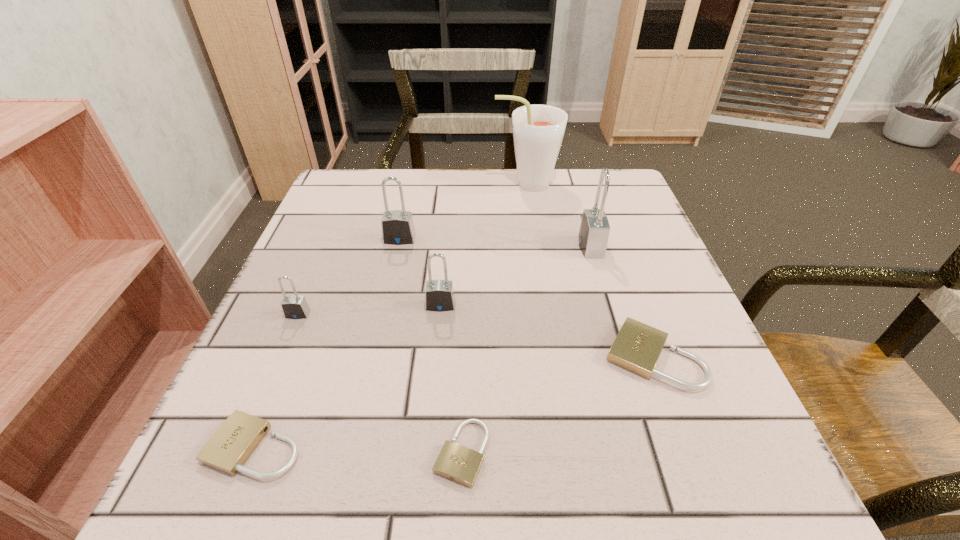
In order to click on free space between the third gray padlock from left to right and the root beer in this screenshot , I will do `click(483, 245)`.

Image resolution: width=960 pixels, height=540 pixels. I want to click on empty space that is in between the smallest beige padlock and the biggest beige padlock, so click(x=558, y=404).

The width and height of the screenshot is (960, 540). I want to click on vacant space that is in between the fifth tallest object and the second biggest gray padlock, so click(348, 276).

Where is `empty space that is in between the third nearest padlock and the leftmost gray padlock`? This screenshot has height=540, width=960. empty space that is in between the third nearest padlock and the leftmost gray padlock is located at coordinates (475, 335).

Locate an element on the screen. The height and width of the screenshot is (540, 960). vacant space that's between the biggest gray padlock and the third smallest gray padlock is located at coordinates (495, 243).

You are a GUI agent. You are given a task and a screenshot of the screen. Output one action in this format:
    pyautogui.click(x=<x>, y=<y>)
    Task: Click on the vacant point located between the second biggest gray padlock and the seventh shortest object
    This screenshot has width=960, height=540.
    Given the screenshot: What is the action you would take?
    pyautogui.click(x=495, y=243)

Identify which object is the seventh closest to the farthest object. Please provide its 2D coordinates. Your answer should be formatted as a tuple, i.e. [(x, y)], where the tuple contains the x and y coordinates of a point satisfying the conditions above.

[(228, 449)]

Locate which object is the fourth closest to the sixth shortest object. Please provide its 2D coordinates. Your answer should be formatted as a tuple, i.e. [(x, y)], where the tuple contains the x and y coordinates of a point satisfying the conditions above.

[(594, 230)]

Where is `padlock that is the fifth nearest to the fifth shortest padlock`? The image size is (960, 540). padlock that is the fifth nearest to the fifth shortest padlock is located at coordinates (228, 449).

Locate an element on the screen. This screenshot has width=960, height=540. padlock that stands as the closest to the farthest object is located at coordinates [594, 230].